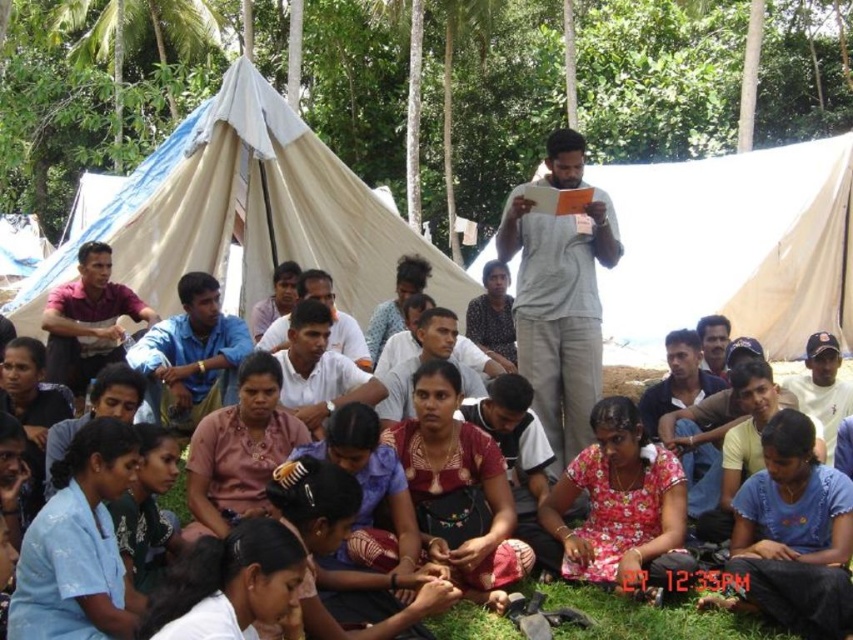
Who is taller, beige canvas tent at upper left or green grass at lower center?

beige canvas tent at upper left is taller.

Find the location of a particular element. beige canvas tent at upper left is located at coordinates (247, 212).

Does point (287, 220) come farther from viewer compared to point (637, 624)?

That is True.

What are the coordinates of `beige canvas tent at upper left` in the screenshot? It's located at (247, 212).

This screenshot has height=640, width=853. Identify the location of beige canvas tent at center. click(x=730, y=248).

Is point (779, 250) positioned in front of point (494, 632)?

No, (779, 250) is behind (494, 632).

Between point (750, 202) and point (662, 616), which one is positioned behind?

The point (750, 202) is behind.

Image resolution: width=853 pixels, height=640 pixels. In order to click on beige canvas tent at center in this screenshot , I will do `click(730, 248)`.

Between gray cotton shirt at center and green grass at lower center, which one appears on the left side from the viewer's perspective?

gray cotton shirt at center

Between gray cotton shirt at center and green grass at lower center, which one is positioned lower?

green grass at lower center

Find the location of a particular element. gray cotton shirt at center is located at coordinates (560, 310).

Where is `gray cotton shirt at center`? The image size is (853, 640). gray cotton shirt at center is located at coordinates (560, 310).